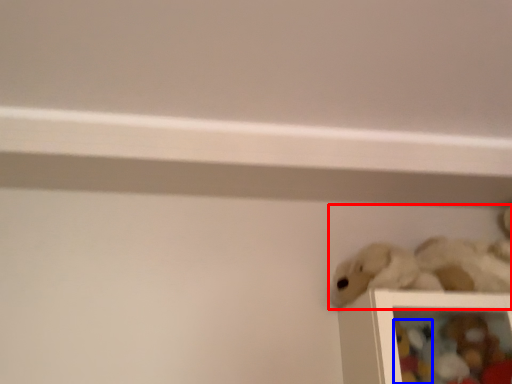
Question: Which of the following is the farthest to the observer, toy (highlighted by a red box) or toy (highlighted by a blue box)?

Choices:
 (A) toy
 (B) toy

Answer: (B)